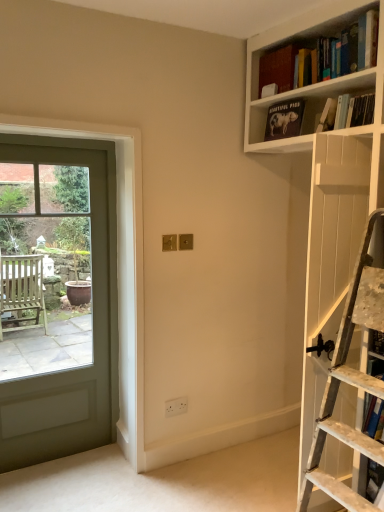
Question: Does matte black book at upper right, acting as the 2th book starting from the top, have a larger size compared to hardcover book at upper right, the second book in the bottom-to-top sequence?

Choices:
 (A) yes
 (B) no

Answer: (B)

Question: Can you confirm if matte black book at upper right, acting as the 2th book starting from the top, is shorter than hardcover book at upper right, the second book in the bottom-to-top sequence?

Choices:
 (A) yes
 (B) no

Answer: (B)

Question: Considering the relative positions of matte black book at upper right, acting as the 2th book starting from the top, and hardcover book at upper right, the fourth book when ordered from top to bottom, in the image provided, is matte black book at upper right, acting as the 2th book starting from the top, to the left of hardcover book at upper right, the fourth book when ordered from top to bottom, from the viewer's perspective?

Choices:
 (A) no
 (B) yes

Answer: (B)

Question: Considering the relative sizes of matte black book at upper right, acting as the 4th book starting from the bottom, and hardcover book at upper right, the fourth book when ordered from top to bottom, in the image provided, is matte black book at upper right, acting as the 4th book starting from the bottom, smaller than hardcover book at upper right, the fourth book when ordered from top to bottom,?

Choices:
 (A) no
 (B) yes

Answer: (B)

Question: Is matte black book at upper right, acting as the 2th book starting from the top, facing away from hardcover book at upper right, the fourth book when ordered from top to bottom?

Choices:
 (A) yes
 (B) no

Answer: (B)

Question: Does matte black book at upper right, acting as the 2th book starting from the top, come behind hardcover book at upper right, the second book in the bottom-to-top sequence?

Choices:
 (A) yes
 (B) no

Answer: (A)

Question: Is matte glass door at left facing towards hardcover book at upper right, the second book in the bottom-to-top sequence?

Choices:
 (A) yes
 (B) no

Answer: (B)

Question: Considering the relative sizes of matte glass door at left and hardcover book at upper right, the fourth book when ordered from top to bottom, in the image provided, is matte glass door at left bigger than hardcover book at upper right, the fourth book when ordered from top to bottom,?

Choices:
 (A) no
 (B) yes

Answer: (B)

Question: Is the position of matte glass door at left less distant than that of hardcover book at upper right, the fourth book when ordered from top to bottom?

Choices:
 (A) no
 (B) yes

Answer: (A)

Question: Is matte glass door at left to the right of hardcover book at upper right, the second book in the bottom-to-top sequence, from the viewer's perspective?

Choices:
 (A) no
 (B) yes

Answer: (A)

Question: Considering the relative sizes of matte glass door at left and hardcover book at upper right, the fourth book when ordered from top to bottom, in the image provided, is matte glass door at left shorter than hardcover book at upper right, the fourth book when ordered from top to bottom,?

Choices:
 (A) yes
 (B) no

Answer: (B)

Question: Is matte glass door at left positioned far away from hardcover book at upper right, the second book in the bottom-to-top sequence?

Choices:
 (A) yes
 (B) no

Answer: (A)

Question: Is blue hardcover book at right, which is the 5th book in top-to-bottom order, at the left side of matte glass door at left?

Choices:
 (A) yes
 (B) no

Answer: (B)